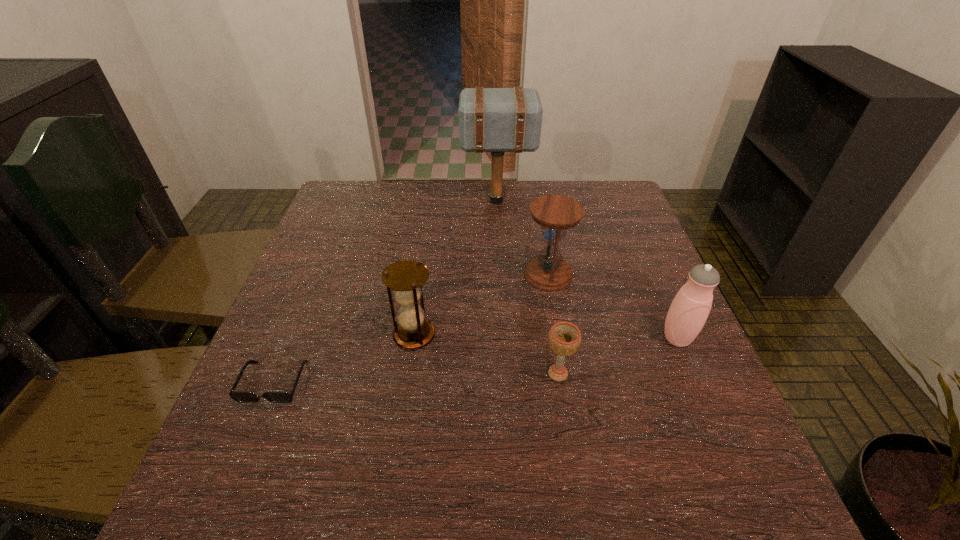
This screenshot has height=540, width=960. What are the coordinates of `blank area in the image that satisfies the following two spatial constraints: 1. on the front side of the farther hourglass; 2. on the right side of the rightmost object` in the screenshot? It's located at (559, 339).

You are a GUI agent. You are given a task and a screenshot of the screen. Output one action in this format:
    pyautogui.click(x=<x>, y=<y>)
    Task: Click on the vacant space that satisfies the following two spatial constraints: 1. on the striking surface of the tallest object; 2. on the back side of the right hourglass
    This screenshot has width=960, height=540.
    Given the screenshot: What is the action you would take?
    pyautogui.click(x=501, y=275)

This screenshot has height=540, width=960. I want to click on free spot that satisfies the following two spatial constraints: 1. on the striking surface of the tallest object; 2. on the right side of the right hourglass, so click(501, 275).

At what (x,y) coordinates should I click in order to perform the action: click on free spot that satisfies the following two spatial constraints: 1. on the striking surface of the tallest object; 2. on the back side of the second farthest object. Please return your answer as a coordinate pair (x, y). The width and height of the screenshot is (960, 540). Looking at the image, I should click on (501, 275).

Identify the location of free location that satisfies the following two spatial constraints: 1. on the striking surface of the tallest object; 2. on the right side of the farther hourglass. This screenshot has width=960, height=540. (501, 275).

Locate an element on the screen. free space that satisfies the following two spatial constraints: 1. on the striking surface of the tallest object; 2. on the right side of the fifth nearest object is located at coordinates (501, 275).

Locate an element on the screen. vacant space that satisfies the following two spatial constraints: 1. on the back side of the fifth tallest object; 2. on the left side of the second farthest object is located at coordinates (542, 275).

This screenshot has width=960, height=540. In order to click on free spot that satisfies the following two spatial constraints: 1. on the striking surface of the mallet; 2. on the front-facing side of the leftmost object in this screenshot , I will do [507, 382].